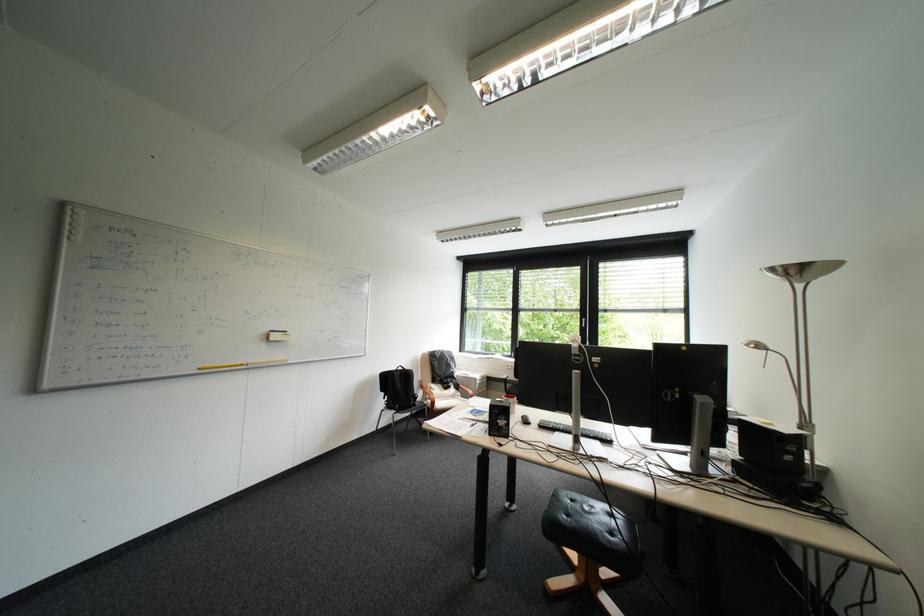
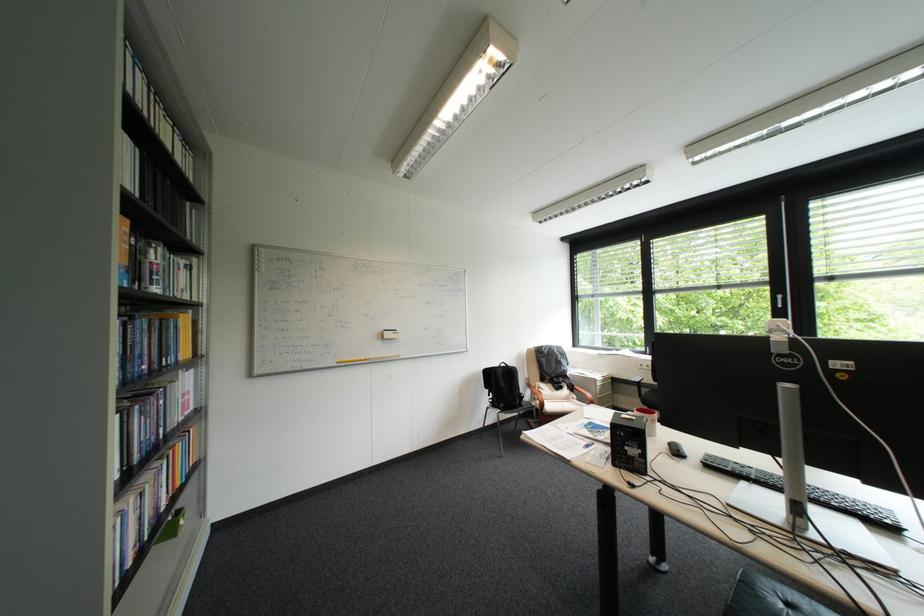
The point at (535, 418) is marked in the first image. Where is the corresponding point in the second image?

(682, 445)